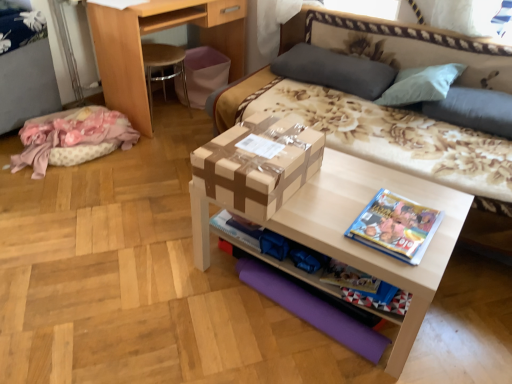
Find the location of `vacant point above matte cardboard box at center (from a real-world perspective)`. vacant point above matte cardboard box at center (from a real-world perspective) is located at coordinates (367, 203).